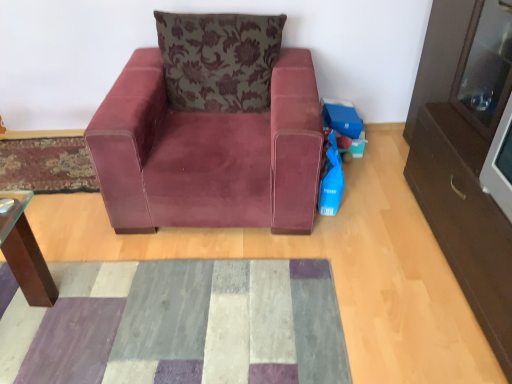
At what (x,y) coordinates should I click in order to perform the action: click on vacant space in front of velvet maroon armchair at center. Please return your answer as a coordinate pair (x, y). The width and height of the screenshot is (512, 384). Looking at the image, I should click on (210, 301).